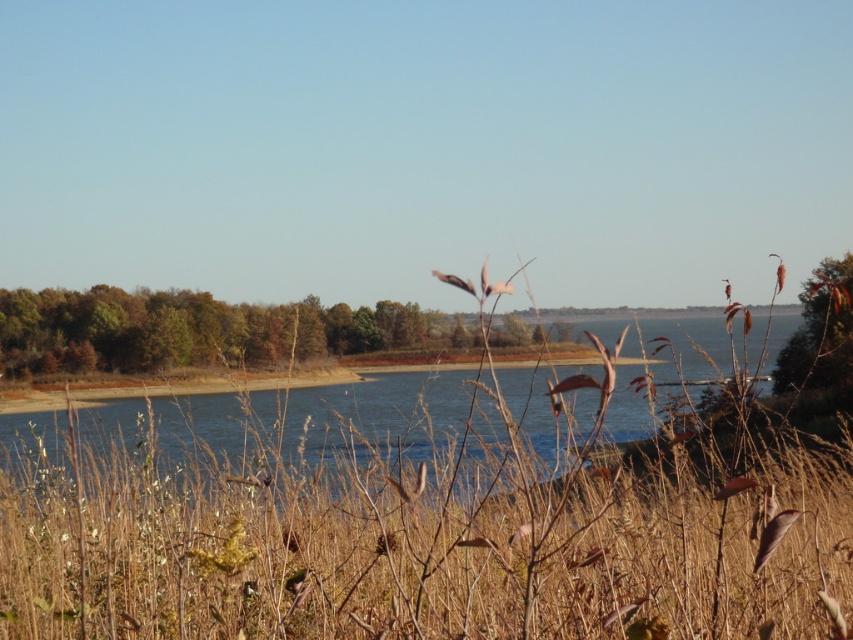
Question: Does brown dry grass at center have a greater width compared to brown matte branch at upper right?

Choices:
 (A) no
 (B) yes

Answer: (B)

Question: Which of the following is the farthest from the observer?

Choices:
 (A) brown matte branch at upper right
 (B) brown dry grass at center

Answer: (A)

Question: Can you confirm if brown dry grass at center is bigger than brown matte branch at upper right?

Choices:
 (A) yes
 (B) no

Answer: (A)

Question: Which object appears closest to the camera in this image?

Choices:
 (A) brown matte branch at upper right
 (B) brown dry grass at center

Answer: (B)

Question: Does brown dry grass at center have a lesser width compared to brown matte branch at upper right?

Choices:
 (A) no
 (B) yes

Answer: (A)

Question: Which object is closer to the camera taking this photo?

Choices:
 (A) brown matte branch at upper right
 (B) brown dry grass at center

Answer: (B)